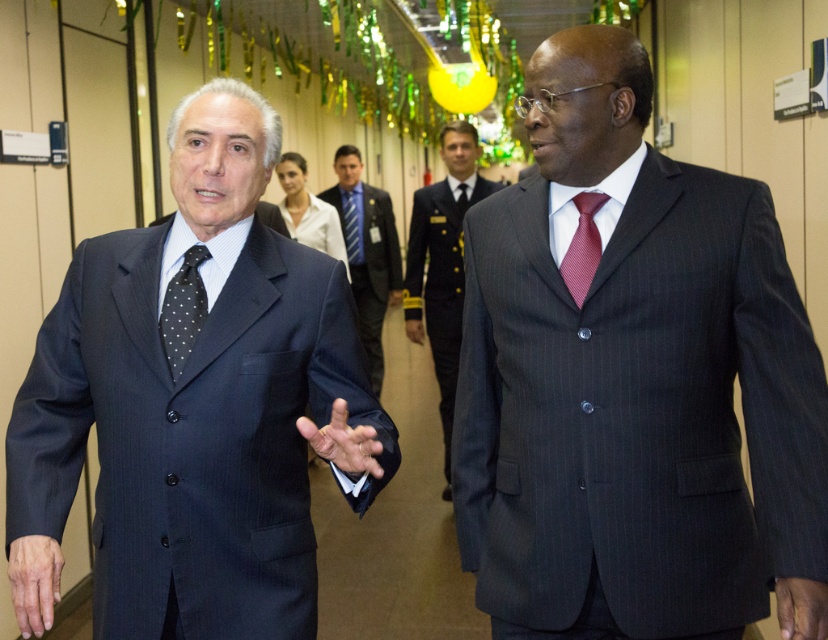
Image resolution: width=828 pixels, height=640 pixels. What do you see at coordinates (581, 246) in the screenshot?
I see `red textured tie at center` at bounding box center [581, 246].

Can you confirm if red textured tie at center is thinner than dark blue silk tie at center?

Incorrect, red textured tie at center's width is not less than dark blue silk tie at center's.

Does point (567, 285) lie behind point (460, 205)?

No.

The width and height of the screenshot is (828, 640). I want to click on red textured tie at center, so click(581, 246).

Can you confirm if blue striped tie at center is taller than dark blue silk tie at center?

Correct, blue striped tie at center is much taller as dark blue silk tie at center.

Does blue striped tie at center appear on the left side of dark blue silk tie at center?

Correct, you'll find blue striped tie at center to the left of dark blue silk tie at center.

Between point (357, 260) and point (463, 211), which one is positioned in front?

Positioned in front is point (463, 211).

Identify the location of blue striped tie at center. (352, 225).

Can you confirm if dark gray suit at center is positioned to the right of dark blue silk tie at center?

No, dark gray suit at center is not to the right of dark blue silk tie at center.

Is point (379, 392) positioned in front of point (463, 182)?

No.

The image size is (828, 640). I want to click on dark gray suit at center, so click(x=366, y=252).